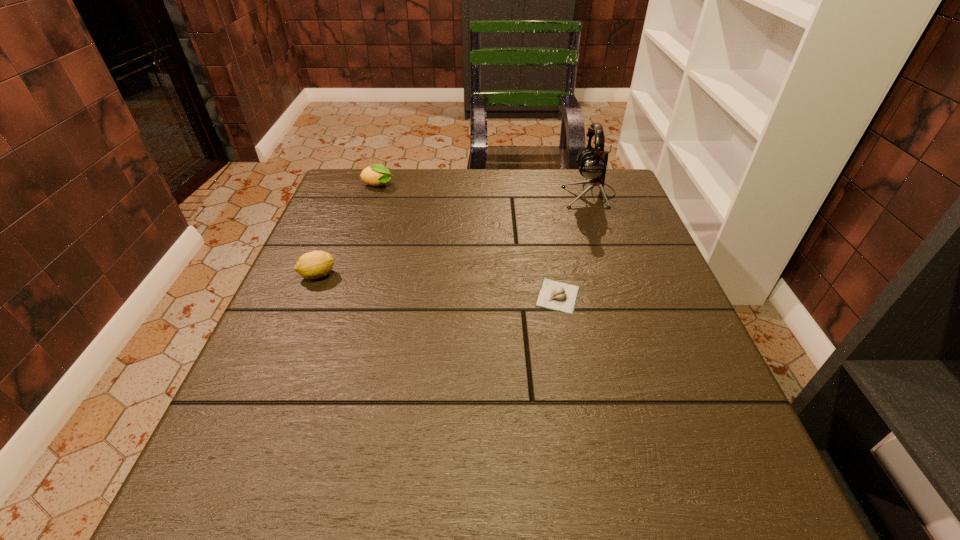
Identify the location of free spot between the farther lemon and the rightmost object. This screenshot has width=960, height=540. (484, 190).

What are the coordinates of `free space between the nearer lemon and the garlic` in the screenshot? It's located at (438, 286).

Identify which object is located as the second nearest to the second object from right to left. Please provide its 2D coordinates. Your answer should be formatted as a tuple, i.e. [(x, y)], where the tuple contains the x and y coordinates of a point satisfying the conditions above.

[(316, 264)]

Locate an element on the screen. The width and height of the screenshot is (960, 540). object identified as the third closest to the earphone is located at coordinates (316, 264).

You are a GUI agent. You are given a task and a screenshot of the screen. Output one action in this format:
    pyautogui.click(x=<x>, y=<y>)
    Task: Click on the blank space that satisfies the following two spatial constraints: 1. with leaves positioned above the farther lemon; 2. on the back side of the rightmost object
    The height and width of the screenshot is (540, 960).
    Given the screenshot: What is the action you would take?
    pyautogui.click(x=375, y=194)

Image resolution: width=960 pixels, height=540 pixels. What are the coordinates of `free space that satisfies the following two spatial constraints: 1. at the stem end of the shortest object; 2. on the right side of the nearer lemon` in the screenshot? It's located at (309, 296).

Find the location of a particular element. free space in the image that satisfies the following two spatial constraints: 1. with leaves positioned above the earphone; 2. on the left side of the farther lemon is located at coordinates (375, 194).

Identify the location of vacant region that satisfies the following two spatial constraints: 1. with leaves positioned above the farther lemon; 2. on the right side of the garlic. The height and width of the screenshot is (540, 960). (342, 296).

Image resolution: width=960 pixels, height=540 pixels. Identify the location of vacant area that satisfies the following two spatial constraints: 1. at the stem end of the garlic; 2. on the left side of the nearer lemon. (309, 296).

You are a GUI agent. You are given a task and a screenshot of the screen. Output one action in this format:
    pyautogui.click(x=<x>, y=<y>)
    Task: Click on the vacant area that satisfies the following two spatial constraints: 1. with leaves positioned above the rightmost object; 2. on the left side of the farther lemon
    The image size is (960, 540).
    Given the screenshot: What is the action you would take?
    pyautogui.click(x=375, y=194)